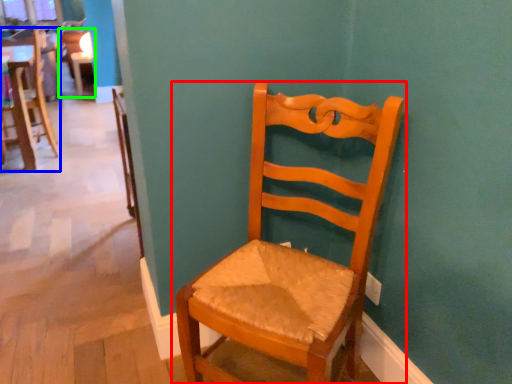
Question: Based on their relative distances, which object is nearer to chair (highlighted by a red box)? Choose from chair (highlighted by a blue box) and chair (highlighted by a green box).

Choices:
 (A) chair
 (B) chair

Answer: (A)